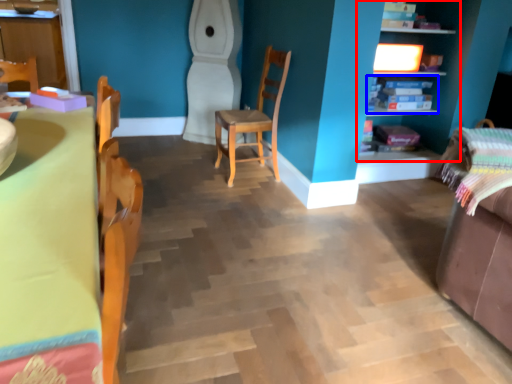
Question: Which point is further to the camera, shelf (highlighted by a red box) or shelf (highlighted by a blue box)?

Choices:
 (A) shelf
 (B) shelf

Answer: (B)